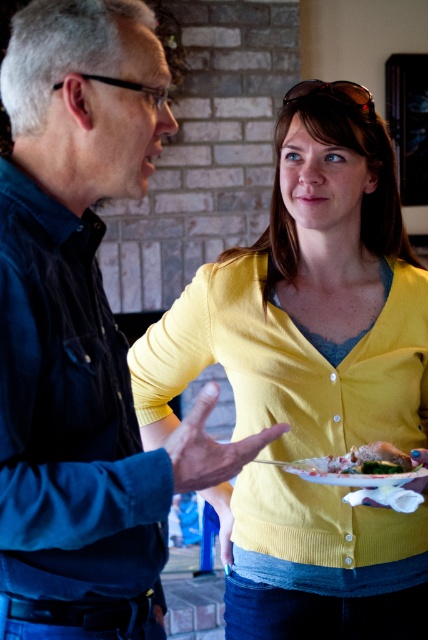
Which is in front, point (142, 452) or point (404, 454)?

Point (142, 452)

Who is taller, matte black shirt at left or shiny silver plate at center?

matte black shirt at left

Identify the location of matte black shirt at left. This screenshot has height=640, width=428. (83, 332).

This screenshot has height=640, width=428. I want to click on matte black shirt at left, so click(83, 332).

Is yellow knit cardigan at center smaller than shiny silver plate at center?

Actually, yellow knit cardigan at center might be larger than shiny silver plate at center.

Between yellow knit cardigan at center and shiny silver plate at center, which one has more height?

Standing taller between the two is yellow knit cardigan at center.

Between point (262, 333) and point (376, 465), which one is positioned behind?

The point (262, 333) is more distant.

Identify the location of yellow knit cardigan at center. (308, 298).

Which is below, yellow knit cardigan at center or matte black shirt at left?

yellow knit cardigan at center is lower down.

Can you confirm if yellow knit cardigan at center is smaller than matte black shirt at left?

No, yellow knit cardigan at center is not smaller than matte black shirt at left.

Is point (204, 353) behind point (62, 83)?

That is True.

Find the location of a particular element. The width and height of the screenshot is (428, 640). yellow knit cardigan at center is located at coordinates (308, 298).